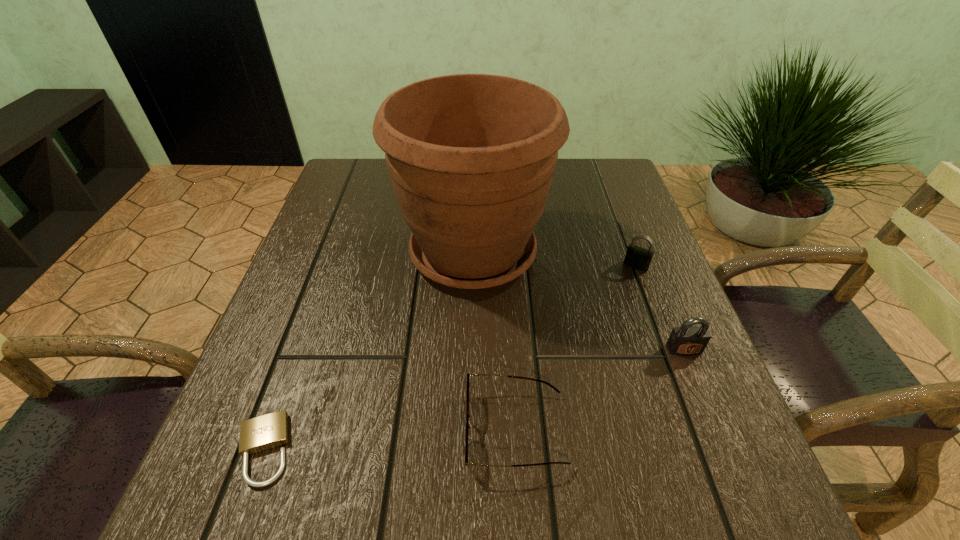
In the image, there is a desktop. Where is `free space at the right edge`? free space at the right edge is located at coordinates (620, 209).

In the image, there is a desktop. Where is `vacant space at the far left corner`? This screenshot has width=960, height=540. vacant space at the far left corner is located at coordinates (355, 184).

In the image, there is a desktop. Where is `free region at the near left corner`? This screenshot has height=540, width=960. free region at the near left corner is located at coordinates (227, 513).

The width and height of the screenshot is (960, 540). What are the coordinates of `blank space at the far right corner of the desktop` in the screenshot? It's located at (607, 170).

Find the location of `vacant region between the farthest padlock and the third nearest object`. vacant region between the farthest padlock and the third nearest object is located at coordinates (660, 308).

Find the location of a particular element. vacant space that is in between the farthest padlock and the leftmost padlock is located at coordinates (449, 357).

Find the location of a particular element. The image size is (960, 540). vacant space that's between the third nearest object and the second shortest object is located at coordinates (600, 390).

The height and width of the screenshot is (540, 960). Identify the location of free spot between the spectacles and the shortest padlock. (389, 440).

Locate an element on the screen. The width and height of the screenshot is (960, 540). free spot between the second shortest object and the shortest object is located at coordinates (389, 440).

Find the location of a particular element. vacant area that lies between the third nearest object and the tallest object is located at coordinates (579, 301).